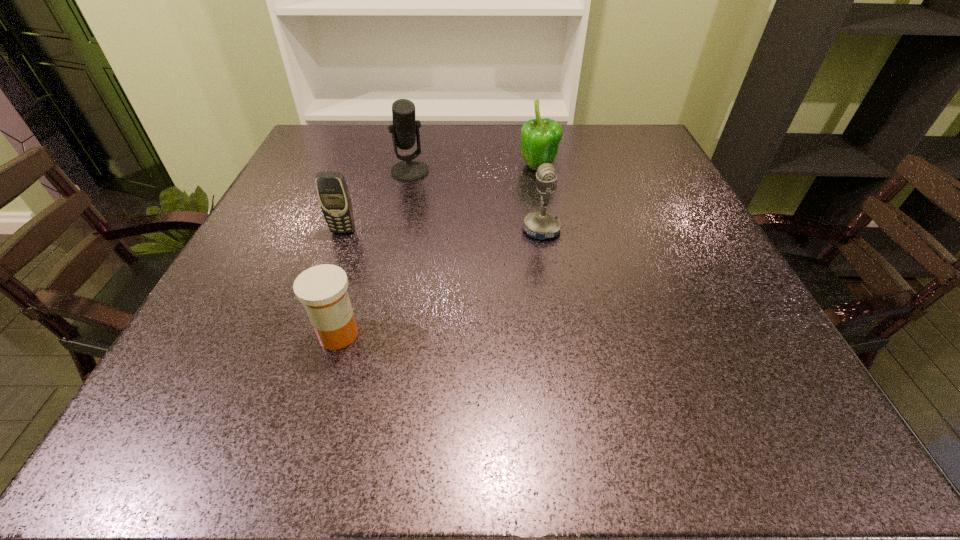
The width and height of the screenshot is (960, 540). In the image, there is a desktop. What are the coordinates of `free space at the right edge` in the screenshot? It's located at (617, 190).

This screenshot has width=960, height=540. In the image, there is a desktop. Identify the location of vacant area at the far left corner. (300, 164).

You are a GUI agent. You are given a task and a screenshot of the screen. Output one action in this format:
    pyautogui.click(x=<x>, y=<y>)
    Task: Click on the free spot at the far right corner of the desktop
    The image size is (960, 540).
    Given the screenshot: What is the action you would take?
    pyautogui.click(x=628, y=125)

Image resolution: width=960 pixels, height=540 pixels. I want to click on vacant space in between the farther microphone and the cellular telephone, so click(x=376, y=201).

Locate an element on the screen. The image size is (960, 540). unoccupied area between the left microphone and the cellular telephone is located at coordinates (376, 201).

Identify the location of free space between the cellular telephone and the farther microphone. (376, 201).

The width and height of the screenshot is (960, 540). I want to click on empty location between the farther microphone and the nearer microphone, so point(476,200).

The height and width of the screenshot is (540, 960). In order to click on empty space that is in between the bell pepper and the nearest object in this screenshot , I will do (438, 251).

What are the coordinates of `vacant region between the right microphone and the medicine` in the screenshot? It's located at (440, 282).

You are a GUI agent. You are given a task and a screenshot of the screen. Output one action in this format:
    pyautogui.click(x=<x>, y=<y>)
    Task: Click on the free space between the bell pepper and the farther microphone
    
    Given the screenshot: What is the action you would take?
    pyautogui.click(x=474, y=170)